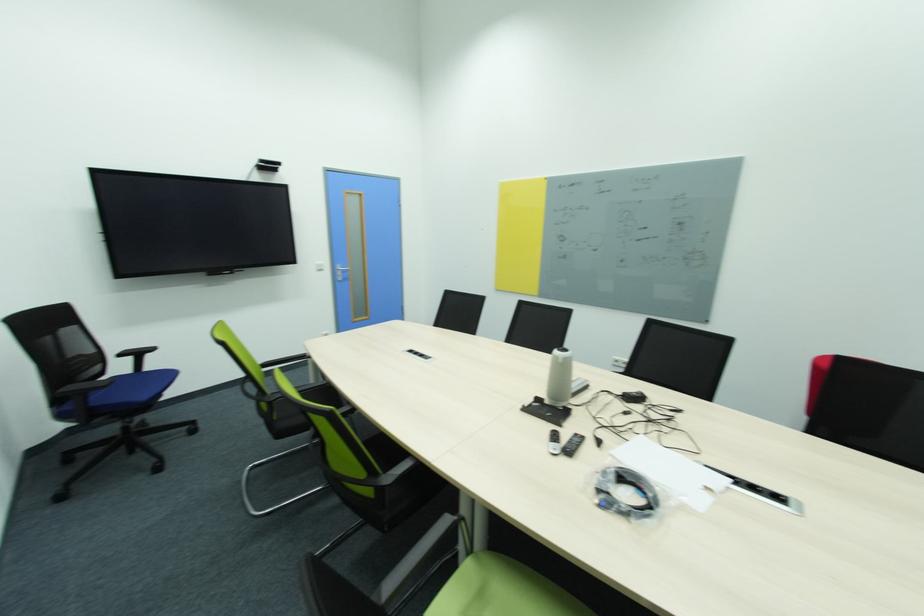
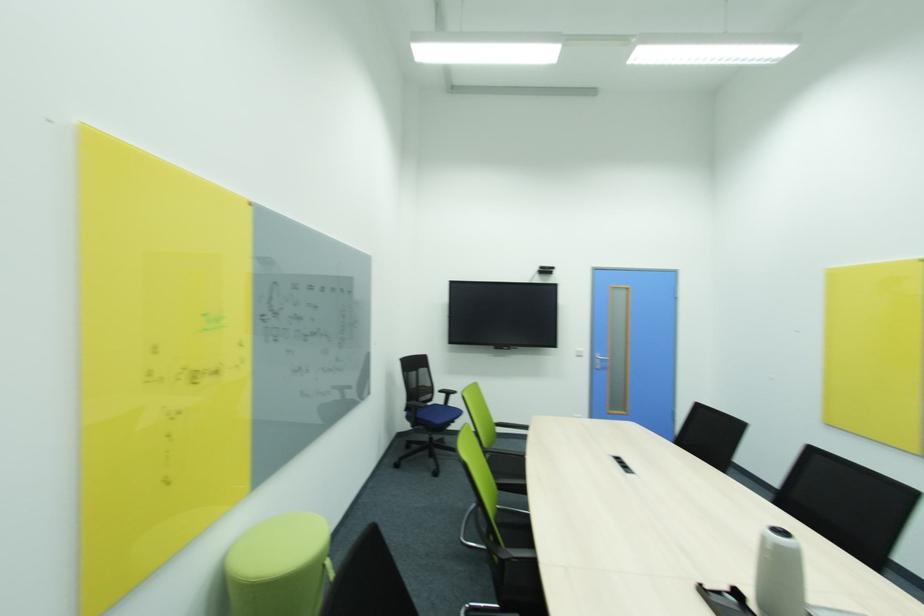
Find the pixel in the second image that matches pixel 73 331 in the first image.

(428, 371)